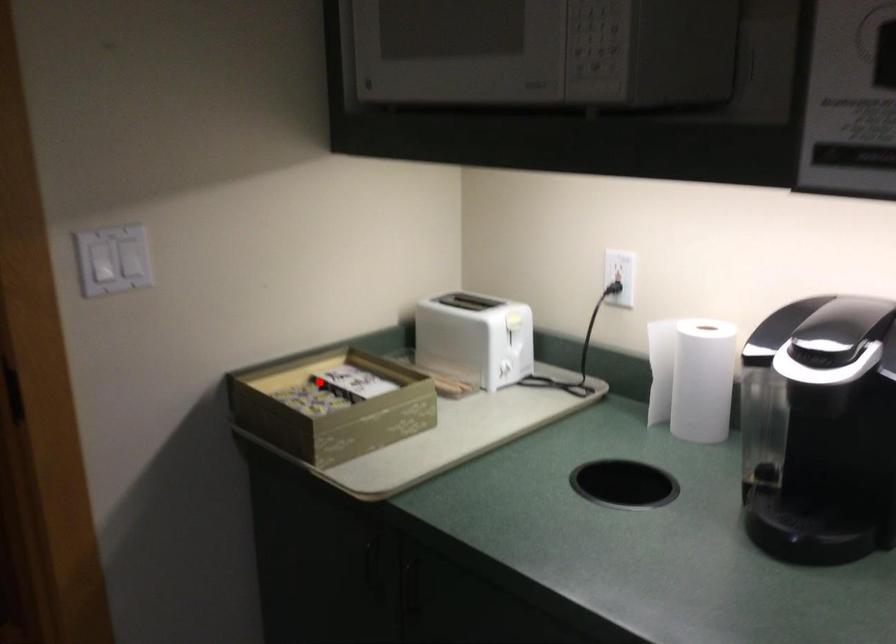
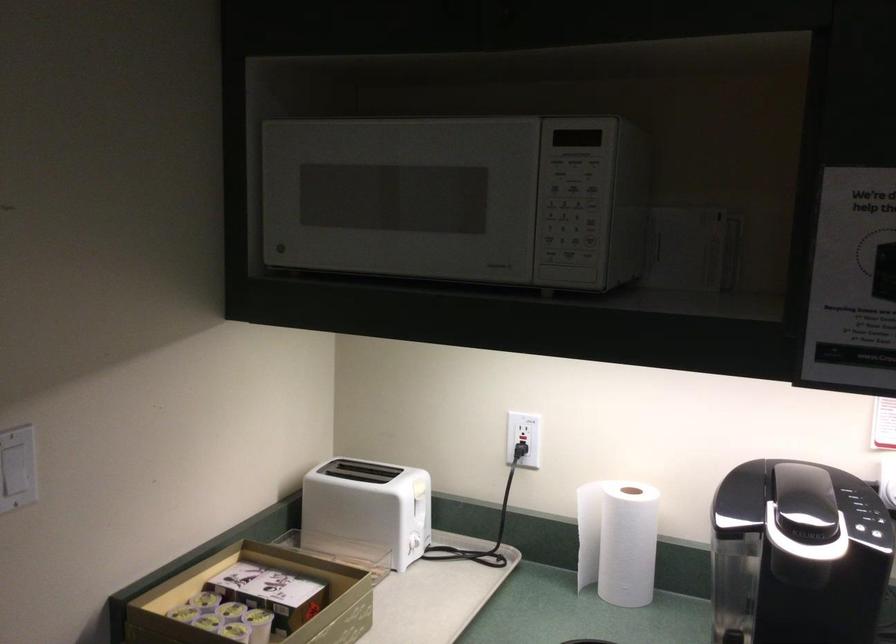
The point at the highlighted location is marked in the first image. Where is the corresponding point in the second image?

(227, 592)